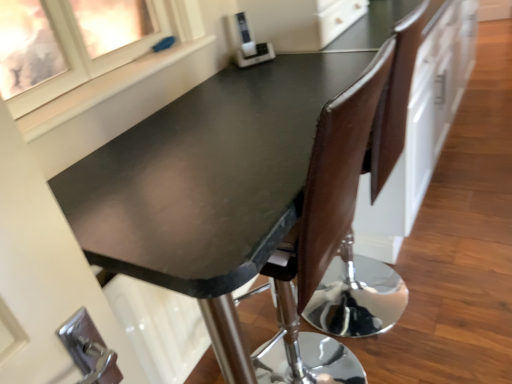
Locate an element on the screen. This screenshot has height=384, width=512. vacant space situated on the left part of white plastic appliance at upper center is located at coordinates (227, 76).